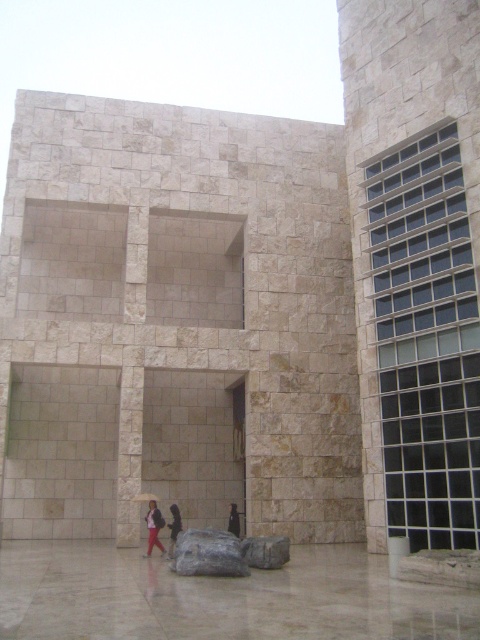
Question: Which of the following is the farthest from the observer?

Choices:
 (A) (172, 545)
 (B) (192, 536)
 (C) (268, 540)

Answer: (A)

Question: Which object appears closest to the camera in this image?

Choices:
 (A) dark gray fabric jacket at center
 (B) gray stone boulder at center
 (C) dark gray fabric umbrella at lower center
 (D) dark fabric umbrella at lower center

Answer: (B)

Question: Can you confirm if gray rough stone at center is positioned above dark gray fabric jacket at center?

Choices:
 (A) no
 (B) yes

Answer: (B)

Question: Is gray stone boulder at center positioned at the back of dark gray fabric jacket at center?

Choices:
 (A) yes
 (B) no

Answer: (B)

Question: Considering the relative positions of gray stone boulder at center and dark gray fabric jacket at center in the image provided, where is gray stone boulder at center located with respect to dark gray fabric jacket at center?

Choices:
 (A) below
 (B) above

Answer: (B)

Question: Estimate the real-world distances between objects in this image. Which object is closer to the gray stone boulder at center?

Choices:
 (A) dark gray fabric umbrella at lower center
 (B) dark fabric umbrella at lower center
 (C) dark gray fabric jacket at center
 (D) gray rough stone at center

Answer: (D)